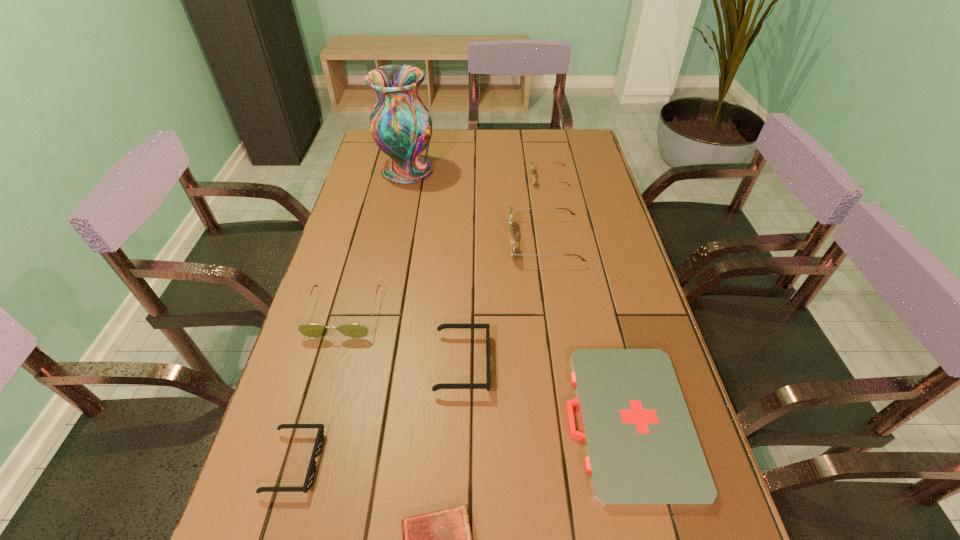
Image resolution: width=960 pixels, height=540 pixels. I want to click on object that is the sixth closest to the gray first-aid kit, so click(532, 162).

Where is `object that is the fifth nearest to the left black sunglasses`? This screenshot has width=960, height=540. object that is the fifth nearest to the left black sunglasses is located at coordinates (512, 229).

Where is `sunglasses that is the second closest to the tallest object`? The width and height of the screenshot is (960, 540). sunglasses that is the second closest to the tallest object is located at coordinates (532, 162).

Identify the location of the second closest sunglasses to the biggest green sunglasses. Image resolution: width=960 pixels, height=540 pixels. (487, 385).

Where is `green sunglasses that is the closest to the fourth shortest sunglasses`? This screenshot has height=540, width=960. green sunglasses that is the closest to the fourth shortest sunglasses is located at coordinates (512, 229).

Find the location of a particular element. the closest green sunglasses relative to the sixth shortest object is located at coordinates pos(512,229).

The width and height of the screenshot is (960, 540). I want to click on free location that satisfies the following two spatial constraints: 1. on the front-facing side of the third farthest object; 2. on the front-facing side of the nearest green sunglasses, so tap(556, 313).